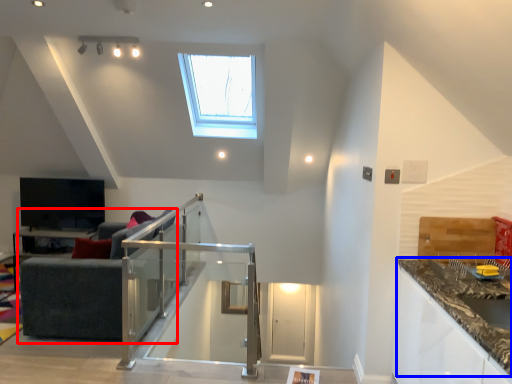
Question: Which point is further to the camera, studio couch (highlighted by a red box) or countertop (highlighted by a blue box)?

Choices:
 (A) studio couch
 (B) countertop

Answer: (A)